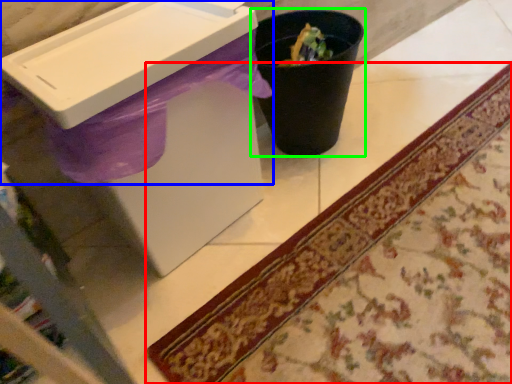
Question: Which object is the closest to the mat (highlighted by a red box)? Choose among these: sink (highlighted by a blue box) or waste container (highlighted by a green box).

Choices:
 (A) sink
 (B) waste container

Answer: (B)